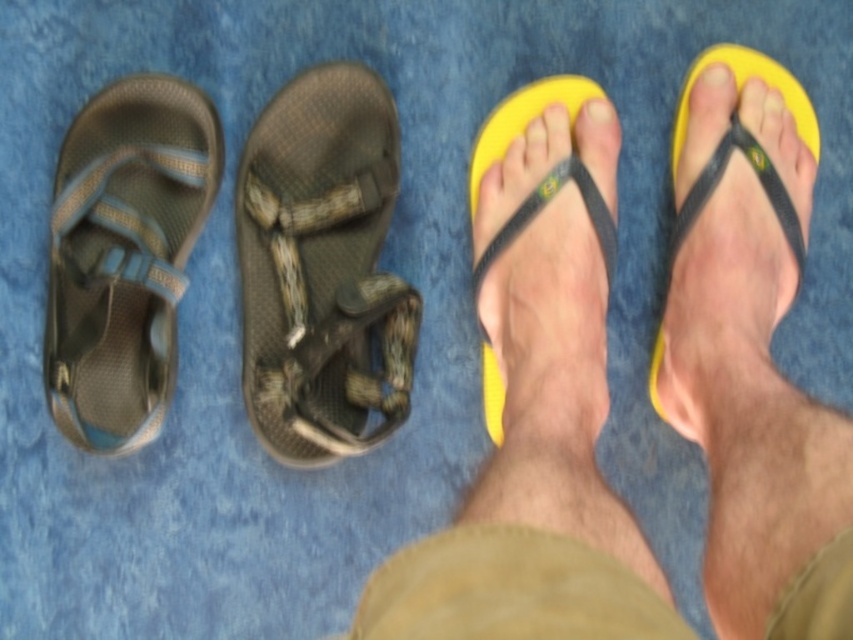
Is matte gray sandal at left positioned in front of yellow matte toe at upper center?

Yes, it is.

Who is taller, matte gray sandal at left or yellow matte toe at upper center?

matte gray sandal at left is taller.

At what (x,y) coordinates should I click in order to perform the action: click on matte gray sandal at left. Please return your answer as a coordinate pair (x, y). The width and height of the screenshot is (853, 640). Looking at the image, I should click on (125, 256).

Can you confirm if matte gray sandal at left is wider than yellow rubber flip-flop at center?

Yes.

Is point (122, 157) positioned before point (566, 106)?

Yes, point (122, 157) is in front of point (566, 106).

Image resolution: width=853 pixels, height=640 pixels. Identify the location of matte gray sandal at left. (125, 256).

Who is positioned more to the left, yellow rubber flip-flops at center or matte gray sandal at left?

Positioned to the left is matte gray sandal at left.

Can you confirm if yellow rubber flip-flops at center is positioned to the left of matte gray sandal at left?

Incorrect, yellow rubber flip-flops at center is not on the left side of matte gray sandal at left.

Which is behind, point (585, 429) or point (44, 340)?

The point (44, 340) is behind.

At what (x,y) coordinates should I click in order to perform the action: click on yellow rubber flip-flops at center. Please return your answer as a coordinate pair (x, y). This screenshot has width=853, height=640. Looking at the image, I should click on (537, 426).